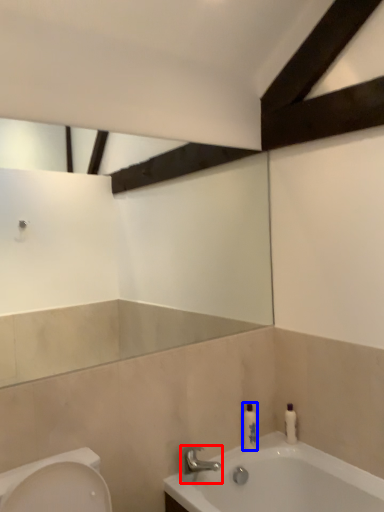
Question: Which object is further to the camera taking this photo, tap (highlighted by a red box) or toiletry (highlighted by a blue box)?

Choices:
 (A) tap
 (B) toiletry

Answer: (B)